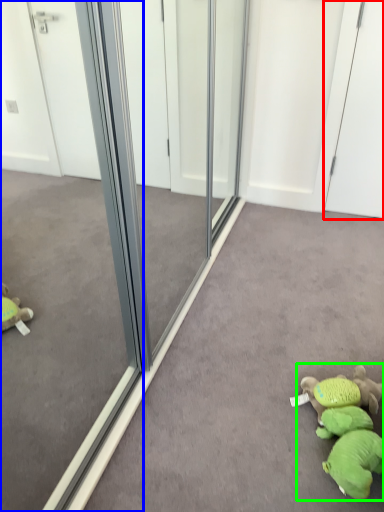
Question: Which is farther away from screen door (highlighted by a red box)? glass door (highlighted by a blue box) or toy (highlighted by a green box)?

Choices:
 (A) glass door
 (B) toy

Answer: (A)